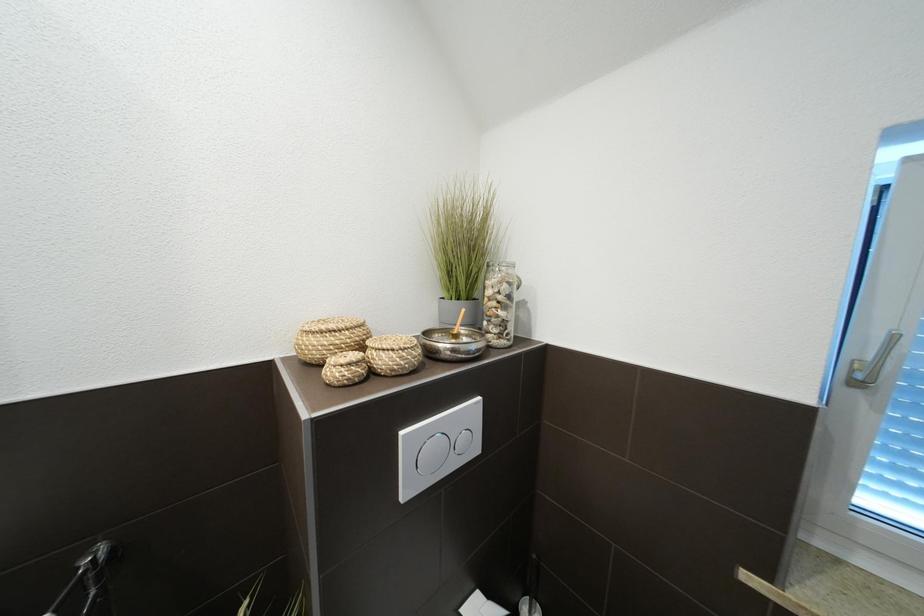
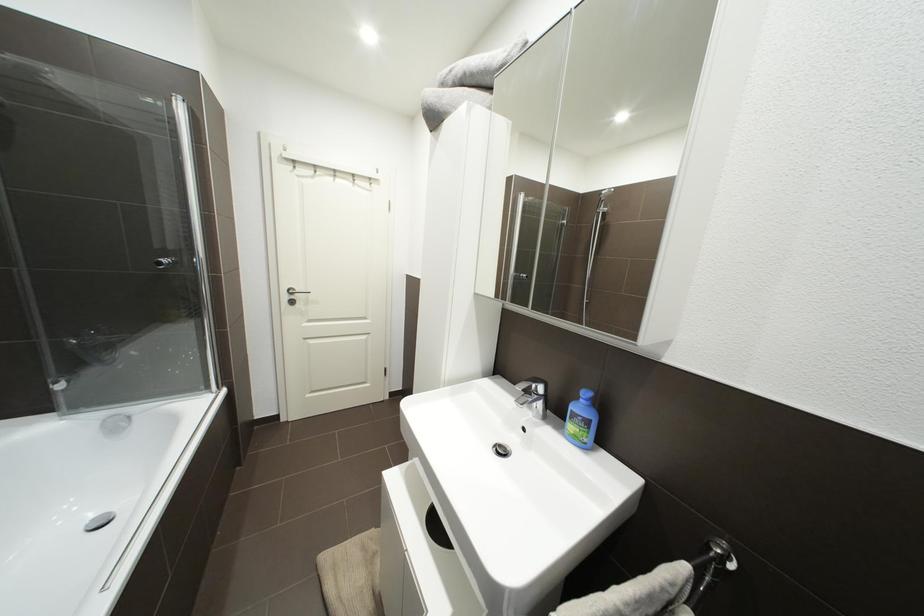
Question: The first image is from the beginning of the video and the second image is from the end. How did the camera likely rotate when shooting the video?

Choices:
 (A) Left
 (B) Right
 (C) Up
 (D) Down

Answer: (A)